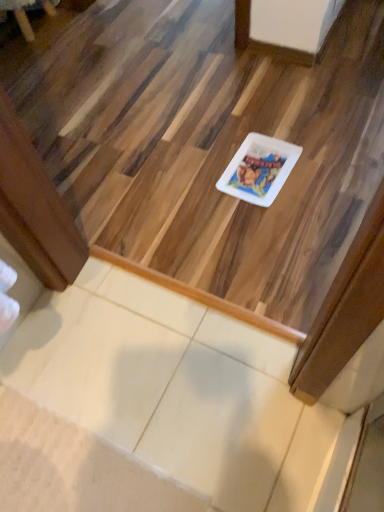
Where is `free spot above white glossy plate at center (from a real-world perspective)`? The width and height of the screenshot is (384, 512). free spot above white glossy plate at center (from a real-world perspective) is located at coordinates (263, 168).